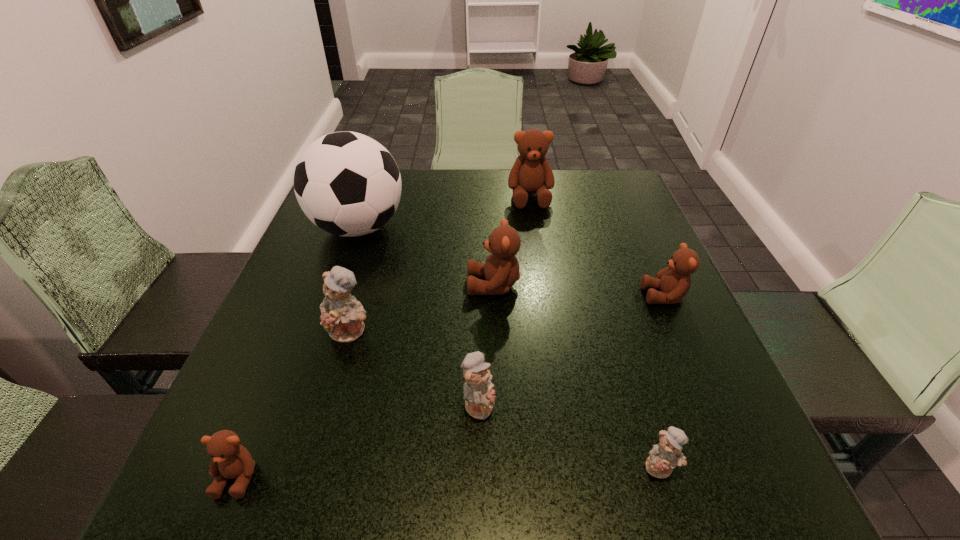
Locate an element on the screen. The height and width of the screenshot is (540, 960). the sixth farthest object is located at coordinates click(x=479, y=396).

Find the location of `the second teddy bear from right to left`. the second teddy bear from right to left is located at coordinates (665, 456).

Locate an element on the screen. the rightmost blue teddy bear is located at coordinates coord(665,456).

Identify the location of the smallest brown teddy bear. (230, 460).

Where is `the leftmost teddy bear`? Image resolution: width=960 pixels, height=540 pixels. the leftmost teddy bear is located at coordinates (230, 460).

Where is `free region located 0.310m on the front of the soccer ball`? This screenshot has width=960, height=540. free region located 0.310m on the front of the soccer ball is located at coordinates (309, 368).

Find the location of a particular element. This screenshot has width=960, height=540. free space located on the face of the farthest teddy bear is located at coordinates tap(538, 248).

Where is `free space located on the face of the second biggest brown teddy bear`? free space located on the face of the second biggest brown teddy bear is located at coordinates (389, 285).

At what (x,y) coordinates should I click in order to perform the action: click on free point located on the face of the second biggest brown teddy bear. Please return your answer as a coordinate pair (x, y). Looking at the image, I should click on (402, 285).

This screenshot has height=540, width=960. Identify the location of free spot located 0.380m on the face of the second biggest brown teddy bear. (291, 285).